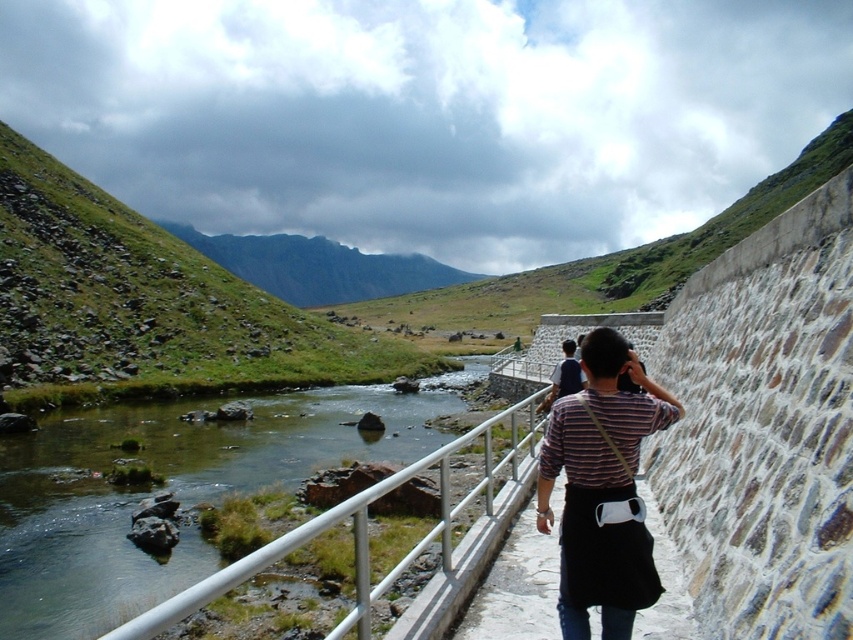
Question: Among these points, which one is farthest from the camera?

Choices:
 (A) (577, 464)
 (B) (457, 504)

Answer: (B)

Question: Is striped fabric shirt at center to the left of white metal railing at lower center from the viewer's perspective?

Choices:
 (A) yes
 (B) no

Answer: (B)

Question: Which of the following is the closest to the observer?

Choices:
 (A) striped fabric shirt at center
 (B) white metal railing at lower center

Answer: (B)

Question: Does striped fabric shirt at center appear under white metal railing at lower center?

Choices:
 (A) no
 (B) yes

Answer: (A)

Question: Can you confirm if striped fabric shirt at center is bigger than white metal railing at lower center?

Choices:
 (A) yes
 (B) no

Answer: (B)